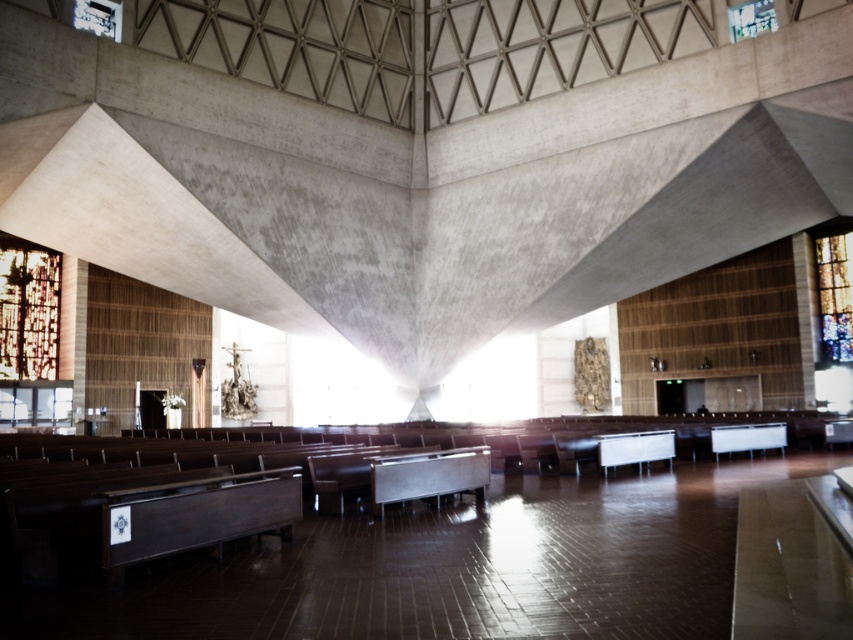
You are an architect designing a new church and want to ensure that the stained glass windows align with the building structure. Given the height difference between the stained glass window at left and stained glass window at right, which one requires a taller support structure?

The stained glass window at left requires a taller support structure because it has a greater height compared to the stained glass window at right.

You are an architect planning to install a new central chandelier in this church. The chandelier requires a minimum of 40 meters of space between the two existing stained glass windows to be safely hung. Based on the scene description, can the chandelier be installed between the stained glass window at left and the stained glass window at right?

The distance between the stained glass window at left and the stained glass window at right is 41.31 meters, which exceeds the required 40 meters. Therefore, the chandelier can be safely installed between them.

You are standing in the modern church and want to take a photo of the stained glass window at left. If your camera has a maximum range of 25 meters, will you be able to capture the entire window in one shot?

The stained glass window at left and camera are 28.90 meters apart, which exceeds the camera maximum range of 25 meters. Therefore, you cannot capture the entire window in one shot.